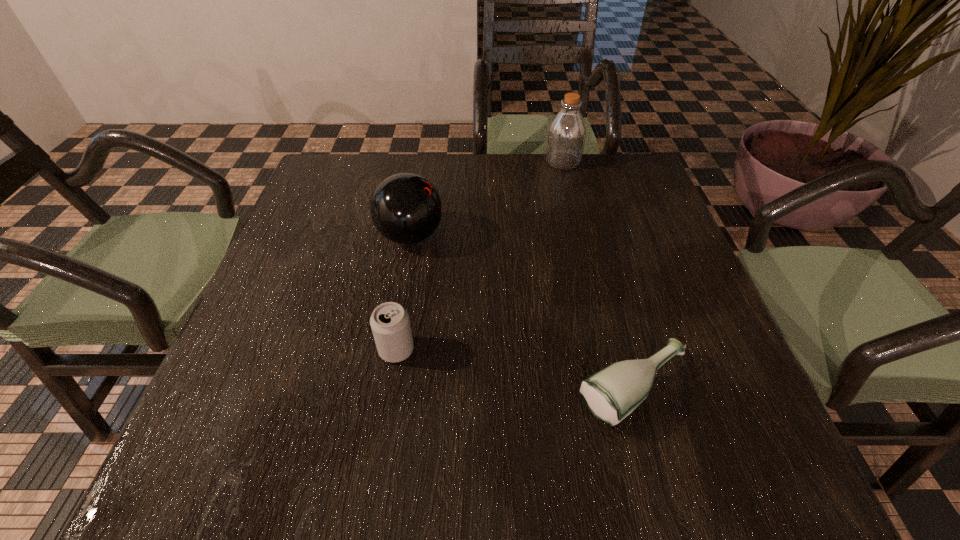
Where is `vacant region between the shorter bottle and the farther bottle`? This screenshot has width=960, height=540. vacant region between the shorter bottle and the farther bottle is located at coordinates (598, 276).

Find the location of a particular element. The height and width of the screenshot is (540, 960). vacant space in between the nearer bottle and the bowling ball is located at coordinates (521, 314).

Identify the location of free area in between the third tallest object and the taller bottle. (479, 256).

The width and height of the screenshot is (960, 540). Find the location of `free spot between the second farthest object and the second shortest object`. free spot between the second farthest object and the second shortest object is located at coordinates (403, 293).

Find the location of a particular element. This screenshot has height=540, width=960. free spot between the third shortest object and the third tallest object is located at coordinates (403, 293).

Locate an element on the screen. This screenshot has height=540, width=960. unoccupied area between the nearer bottle and the third tallest object is located at coordinates (515, 370).

Where is `free space between the shortest object and the farther bottle`? Image resolution: width=960 pixels, height=540 pixels. free space between the shortest object and the farther bottle is located at coordinates (598, 276).

Locate an element on the screen. free point between the second shortest object and the bowling ball is located at coordinates (403, 293).

Where is `free space between the third tallest object and the shorter bottle`? This screenshot has height=540, width=960. free space between the third tallest object and the shorter bottle is located at coordinates (515, 370).

Identify the location of unoccupied position between the nearer bottle and the tallest object. The height and width of the screenshot is (540, 960). (598, 276).